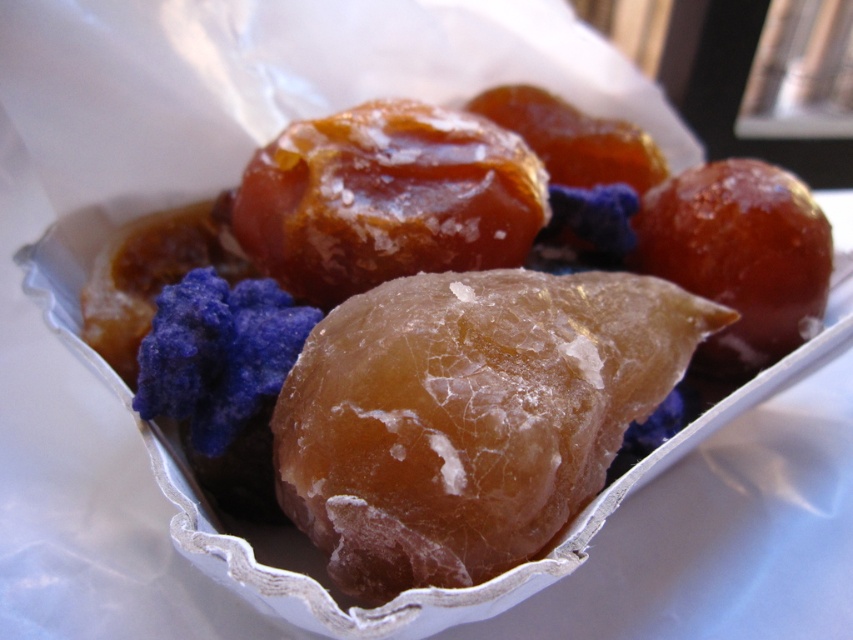
Question: Does glossy caramel treat at center have a greater width compared to glossy caramel candy at center?

Choices:
 (A) no
 (B) yes

Answer: (B)

Question: Does glossy caramel treat at center appear under glossy caramel candy at center?

Choices:
 (A) no
 (B) yes

Answer: (B)

Question: Can you confirm if glossy caramel treat at center is positioned to the right of glossy caramel candy at center?

Choices:
 (A) no
 (B) yes

Answer: (B)

Question: Which point appears farthest from the camera in this image?

Choices:
 (A) (358, 209)
 (B) (397, 104)

Answer: (B)